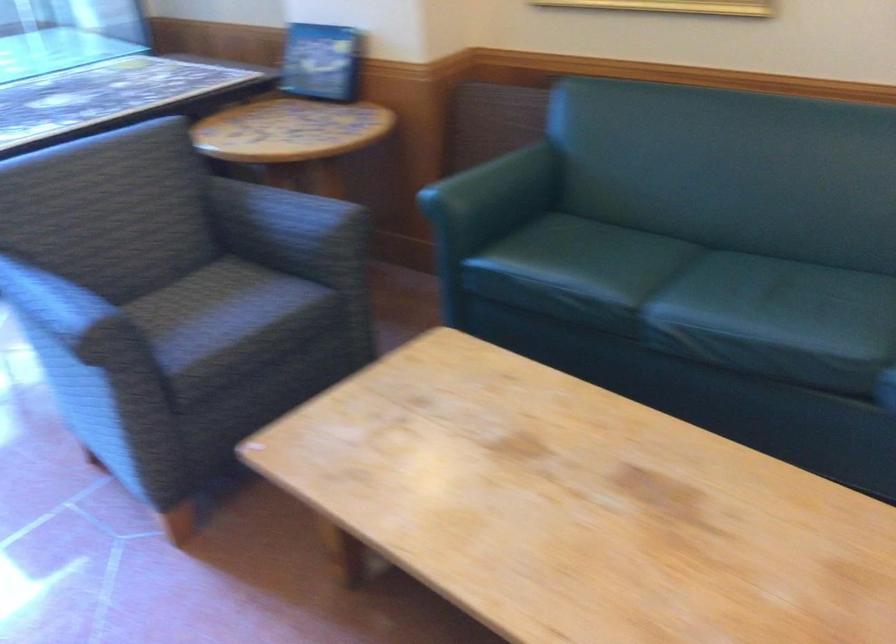
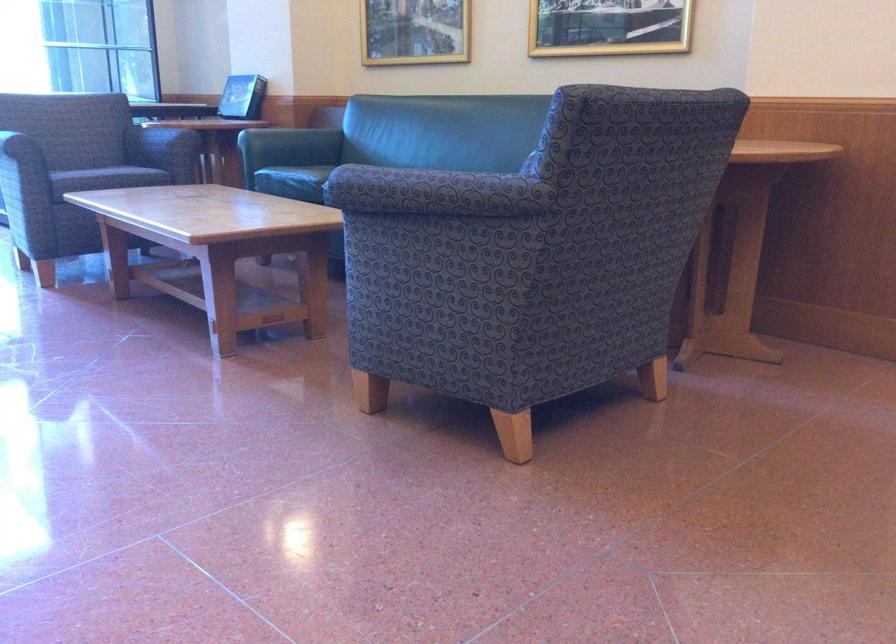
Find the pixel in the second image that matches (x=513, y=202) in the first image.

(290, 145)